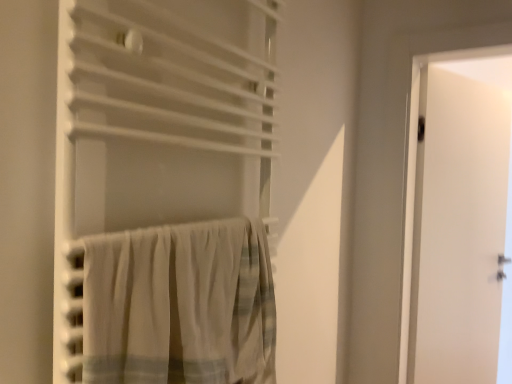
Question: Does white matte door at right have a lesser height compared to white cotton curtain at lower left, arranged as the 1th curtain when ordered from the bottom?

Choices:
 (A) no
 (B) yes

Answer: (A)

Question: Is white matte door at right far from white cotton curtain at lower left, arranged as the 1th curtain when ordered from the bottom?

Choices:
 (A) yes
 (B) no

Answer: (A)

Question: Considering the relative sizes of white matte door at right and white cotton curtain at lower left, arranged as the 2th curtain when viewed from the top, in the image provided, is white matte door at right thinner than white cotton curtain at lower left, arranged as the 2th curtain when viewed from the top,?

Choices:
 (A) yes
 (B) no

Answer: (A)

Question: From the image's perspective, is white matte door at right under white cotton curtain at lower left, arranged as the 2th curtain when viewed from the top?

Choices:
 (A) yes
 (B) no

Answer: (A)

Question: Is white matte door at right taller than white cotton curtain at lower left, arranged as the 1th curtain when ordered from the bottom?

Choices:
 (A) yes
 (B) no

Answer: (A)

Question: Is white cotton curtain at lower left, arranged as the 2th curtain when viewed from the top, located within white matte door at right?

Choices:
 (A) yes
 (B) no

Answer: (B)

Question: Is white cotton curtain at lower left, arranged as the 1th curtain when ordered from the bottom, aimed at white matte door at right?

Choices:
 (A) no
 (B) yes

Answer: (A)

Question: Is white cotton curtain at lower left, arranged as the 2th curtain when viewed from the top, surrounding white matte door at right?

Choices:
 (A) yes
 (B) no

Answer: (B)

Question: Is white cotton curtain at lower left, arranged as the 1th curtain when ordered from the bottom, looking in the opposite direction of white matte door at right?

Choices:
 (A) no
 (B) yes

Answer: (A)

Question: From a real-world perspective, is white cotton curtain at lower left, arranged as the 1th curtain when ordered from the bottom, positioned under white matte door at right based on gravity?

Choices:
 (A) no
 (B) yes

Answer: (A)

Question: Is white cotton curtain at lower left, arranged as the 1th curtain when ordered from the bottom, to the left of white matte door at right from the viewer's perspective?

Choices:
 (A) yes
 (B) no

Answer: (A)

Question: Considering the relative sizes of white cotton curtain at lower left, arranged as the 2th curtain when viewed from the top, and white matte door at right in the image provided, is white cotton curtain at lower left, arranged as the 2th curtain when viewed from the top, wider than white matte door at right?

Choices:
 (A) yes
 (B) no

Answer: (A)

Question: Considering the relative positions of white fabric curtain at center, which is counted as the 1th curtain, starting from the top, and white cotton curtain at lower left, arranged as the 2th curtain when viewed from the top, in the image provided, is white fabric curtain at center, which is counted as the 1th curtain, starting from the top, behind white cotton curtain at lower left, arranged as the 2th curtain when viewed from the top,?

Choices:
 (A) no
 (B) yes

Answer: (A)